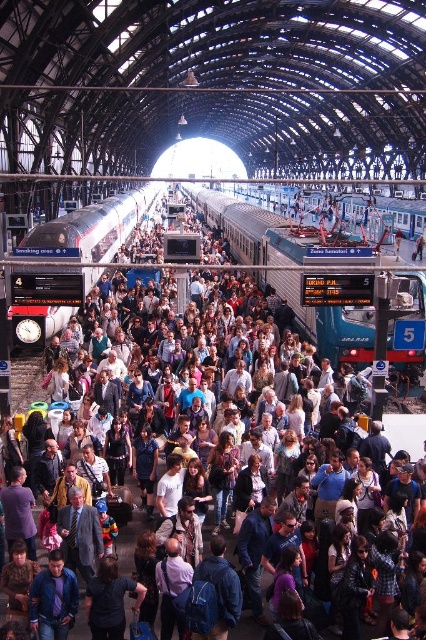
Does teal metallic train at center appear on the left side of silver metallic train at center?

In fact, teal metallic train at center is to the right of silver metallic train at center.

Does teal metallic train at center have a greater height compared to silver metallic train at center?

Yes.

Who is more distant from viewer, [417,298] or [40,307]?

Positioned behind is point [40,307].

Identify the location of teal metallic train at center. (258, 230).